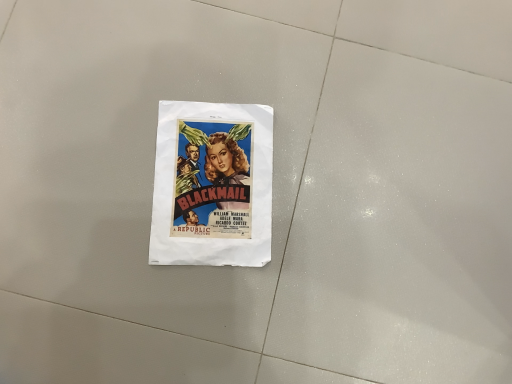
What are the coordinates of `matte paper poster at center` in the screenshot? It's located at (212, 185).

What do you see at coordinates (212, 185) in the screenshot?
I see `matte paper poster at center` at bounding box center [212, 185].

This screenshot has width=512, height=384. I want to click on matte paper poster at center, so pyautogui.click(x=212, y=185).